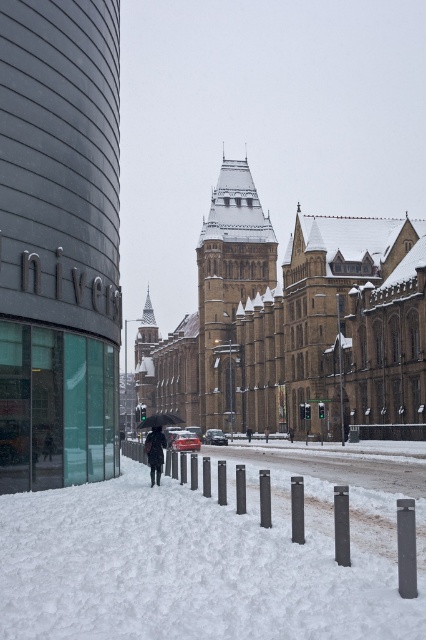
Is dark wool coat at center thinner than black matte umbrella at center?

Correct, dark wool coat at center's width is less than black matte umbrella at center's.

Is dark wool coat at center below black matte umbrella at center?

Actually, dark wool coat at center is above black matte umbrella at center.

Is point (164, 448) positioned before point (169, 420)?

Yes, it is.

Locate an element on the screen. dark wool coat at center is located at coordinates (155, 452).

Is white powdery snow at center closer to camera compared to black matte umbrella at center?

That is True.

Consider the image. Can you confirm if white powdery snow at center is smaller than black matte umbrella at center?

Yes, white powdery snow at center is smaller than black matte umbrella at center.

Is point (129, 548) positioned after point (172, 419)?

No, it is in front of (172, 419).

Where is `white powdery snow at center`? white powdery snow at center is located at coordinates (199, 563).

Based on the photo, which is below, white powdery snow at center or dark wool coat at center?

Positioned lower is white powdery snow at center.

The image size is (426, 640). In order to click on white powdery snow at center in this screenshot , I will do `click(199, 563)`.